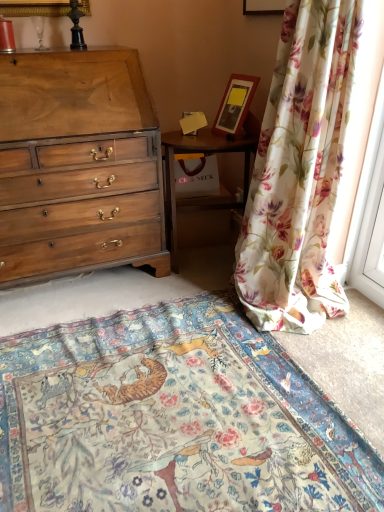
What do you see at coordinates (263, 7) in the screenshot? I see `wooden picture frame at upper center, which is the 1th picture frame in top-to-bottom order` at bounding box center [263, 7].

Describe the element at coordinates (78, 165) in the screenshot. The width and height of the screenshot is (384, 512). I see `light brown wood chest of drawers at left` at that location.

Where is `wooden picture frame at upper right, positioned as the 2th picture frame in top-to-bottom order`? The width and height of the screenshot is (384, 512). wooden picture frame at upper right, positioned as the 2th picture frame in top-to-bottom order is located at coordinates (235, 104).

The height and width of the screenshot is (512, 384). What do you see at coordinates (173, 419) in the screenshot? I see `floral carpet at center` at bounding box center [173, 419].

Where is `wooden picture frame at upper center, the 2th picture frame from the bottom`? This screenshot has height=512, width=384. wooden picture frame at upper center, the 2th picture frame from the bottom is located at coordinates (263, 7).

Which of these two, wooden picture frame at upper center, which is the 1th picture frame in top-to-bottom order, or floral carpet at center, is wider?

floral carpet at center is wider.

Is point (256, 13) positioned before point (275, 439)?

No, (256, 13) is behind (275, 439).

Consider the image. Is wooden picture frame at upper center, which is the 1th picture frame in top-to-bottom order, smaller than floral carpet at center?

Yes, wooden picture frame at upper center, which is the 1th picture frame in top-to-bottom order, is smaller than floral carpet at center.

Considering the relative positions of wooden nightstand at center and wooden picture frame at upper center, which is the 1th picture frame in top-to-bottom order, in the image provided, is wooden nightstand at center to the right of wooden picture frame at upper center, which is the 1th picture frame in top-to-bottom order, from the viewer's perspective?

In fact, wooden nightstand at center is to the left of wooden picture frame at upper center, which is the 1th picture frame in top-to-bottom order.

Could you tell me if wooden nightstand at center is facing wooden picture frame at upper center, the 2th picture frame from the bottom?

No, wooden nightstand at center is not turned towards wooden picture frame at upper center, the 2th picture frame from the bottom.

In the scene shown: Can you confirm if wooden nightstand at center is bigger than wooden picture frame at upper center, which is the 1th picture frame in top-to-bottom order?

Indeed, wooden nightstand at center has a larger size compared to wooden picture frame at upper center, which is the 1th picture frame in top-to-bottom order.

Is floral fabric curtain at right not near wooden picture frame at upper center, the 2th picture frame from the bottom?

floral fabric curtain at right is actually quite close to wooden picture frame at upper center, the 2th picture frame from the bottom.

Which is less distant, (286,133) or (247,7)?

Point (286,133) is closer to the camera than point (247,7).

In the scene shown: Is floral fabric curtain at right turned away from wooden picture frame at upper center, the 2th picture frame from the bottom?

floral fabric curtain at right is not turned away from wooden picture frame at upper center, the 2th picture frame from the bottom.

Is wooden picture frame at upper right, which is the first picture frame in bottom-to-top order, in front of or behind wooden nightstand at center in the image?

wooden picture frame at upper right, which is the first picture frame in bottom-to-top order, is in front of wooden nightstand at center.

Considering the relative positions of wooden picture frame at upper right, positioned as the 2th picture frame in top-to-bottom order, and wooden nightstand at center in the image provided, is wooden picture frame at upper right, positioned as the 2th picture frame in top-to-bottom order, to the left of wooden nightstand at center from the viewer's perspective?

Incorrect, wooden picture frame at upper right, positioned as the 2th picture frame in top-to-bottom order, is not on the left side of wooden nightstand at center.

Is wooden picture frame at upper right, which is the first picture frame in bottom-to-top order, aimed at wooden nightstand at center?

No, wooden picture frame at upper right, which is the first picture frame in bottom-to-top order, is not turned towards wooden nightstand at center.

Is wooden picture frame at upper right, positioned as the 2th picture frame in top-to-bottom order, placed right next to floral fabric curtain at right?

No, wooden picture frame at upper right, positioned as the 2th picture frame in top-to-bottom order, is not next to floral fabric curtain at right.

From a real-world perspective, is wooden picture frame at upper right, which is the first picture frame in bottom-to-top order, located beneath floral fabric curtain at right?

No, from a real-world perspective, wooden picture frame at upper right, which is the first picture frame in bottom-to-top order, is not beneath floral fabric curtain at right.

Is wooden picture frame at upper right, positioned as the 2th picture frame in top-to-bottom order, aimed at floral fabric curtain at right?

No, wooden picture frame at upper right, positioned as the 2th picture frame in top-to-bottom order, is not facing towards floral fabric curtain at right.

Between wooden picture frame at upper right, which is the first picture frame in bottom-to-top order, and floral fabric curtain at right, which one has larger size?

floral fabric curtain at right.

Does point (54, 246) come in front of point (281, 4)?

Yes, point (54, 246) is in front of point (281, 4).

From a real-world perspective, between light brown wood chest of drawers at left and wooden picture frame at upper center, the 2th picture frame from the bottom, who is vertically higher?

wooden picture frame at upper center, the 2th picture frame from the bottom.

Which is more to the right, light brown wood chest of drawers at left or wooden picture frame at upper center, which is the 1th picture frame in top-to-bottom order?

Positioned to the right is wooden picture frame at upper center, which is the 1th picture frame in top-to-bottom order.

Is light brown wood chest of drawers at left facing towards wooden picture frame at upper center, which is the 1th picture frame in top-to-bottom order?

No, light brown wood chest of drawers at left is not aimed at wooden picture frame at upper center, which is the 1th picture frame in top-to-bottom order.

Is floral carpet at center to the left of wooden nightstand at center from the viewer's perspective?

Yes, floral carpet at center is to the left of wooden nightstand at center.

Measure the distance from floral carpet at center to wooden nightstand at center.

floral carpet at center is 39.15 inches away from wooden nightstand at center.

Considering the sizes of floral carpet at center and wooden nightstand at center in the image, is floral carpet at center wider or thinner than wooden nightstand at center?

Clearly, floral carpet at center has more width compared to wooden nightstand at center.

From a real-world perspective, does floral carpet at center stand above wooden nightstand at center?

No.

Where is `mat that appears on the left of wooden picture frame at upper center, which is the 1th picture frame in top-to-bottom order`? This screenshot has height=512, width=384. mat that appears on the left of wooden picture frame at upper center, which is the 1th picture frame in top-to-bottom order is located at coordinates (173, 419).

At what (x,y) coordinates should I click in order to perform the action: click on nightstand behind the wooden picture frame at upper center, the 2th picture frame from the bottom. Please return your answer as a coordinate pair (x, y). Looking at the image, I should click on pos(204,155).

Based on their spatial positions, is wooden nightstand at center or wooden picture frame at upper center, which is the 1th picture frame in top-to-bottom order, further from light brown wood chest of drawers at left?

Among the two, wooden picture frame at upper center, which is the 1th picture frame in top-to-bottom order, is located further to light brown wood chest of drawers at left.

Estimate the real-world distances between objects in this image. Which object is closer to wooden picture frame at upper center, which is the 1th picture frame in top-to-bottom order, light brown wood chest of drawers at left or wooden nightstand at center?

wooden nightstand at center.

Which object lies nearer to the anchor point floral carpet at center, wooden nightstand at center or floral fabric curtain at right?

floral fabric curtain at right is closer to floral carpet at center.

Based on their spatial positions, is wooden picture frame at upper right, which is the first picture frame in bottom-to-top order, or floral carpet at center closer to wooden picture frame at upper center, which is the 1th picture frame in top-to-bottom order?

The object closer to wooden picture frame at upper center, which is the 1th picture frame in top-to-bottom order, is wooden picture frame at upper right, which is the first picture frame in bottom-to-top order.

When comparing their distances from floral fabric curtain at right, does wooden picture frame at upper center, which is the 1th picture frame in top-to-bottom order, or wooden nightstand at center seem further?

wooden picture frame at upper center, which is the 1th picture frame in top-to-bottom order, lies further to floral fabric curtain at right than the other object.

In the scene shown: When comparing their distances from wooden nightstand at center, does floral carpet at center or wooden picture frame at upper right, positioned as the 2th picture frame in top-to-bottom order, seem closer?

The object closer to wooden nightstand at center is wooden picture frame at upper right, positioned as the 2th picture frame in top-to-bottom order.

Considering their positions, is wooden nightstand at center positioned further to wooden picture frame at upper center, the 2th picture frame from the bottom, than wooden picture frame at upper right, positioned as the 2th picture frame in top-to-bottom order?

Based on the image, wooden nightstand at center appears to be further to wooden picture frame at upper center, the 2th picture frame from the bottom.

From the image, which object appears to be nearer to wooden nightstand at center, floral carpet at center or light brown wood chest of drawers at left?

Among the two, light brown wood chest of drawers at left is located nearer to wooden nightstand at center.

The width and height of the screenshot is (384, 512). I want to click on curtain between wooden picture frame at upper center, which is the 1th picture frame in top-to-bottom order, and wooden nightstand at center vertically, so click(x=299, y=170).

This screenshot has height=512, width=384. Find the location of `chest of drawers between wooden picture frame at upper center, which is the 1th picture frame in top-to-bottom order, and wooden nightstand at center, in the vertical direction`. chest of drawers between wooden picture frame at upper center, which is the 1th picture frame in top-to-bottom order, and wooden nightstand at center, in the vertical direction is located at coordinates (78, 165).

Where is `picture frame between wooden picture frame at upper center, which is the 1th picture frame in top-to-bottom order, and wooden nightstand at center in the up-down direction`? picture frame between wooden picture frame at upper center, which is the 1th picture frame in top-to-bottom order, and wooden nightstand at center in the up-down direction is located at coordinates (235, 104).

At what (x,y) coordinates should I click in order to perform the action: click on nightstand between light brown wood chest of drawers at left and wooden picture frame at upper right, which is the first picture frame in bottom-to-top order, in the horizontal direction. Please return your answer as a coordinate pair (x, y). The image size is (384, 512). Looking at the image, I should click on (204, 155).